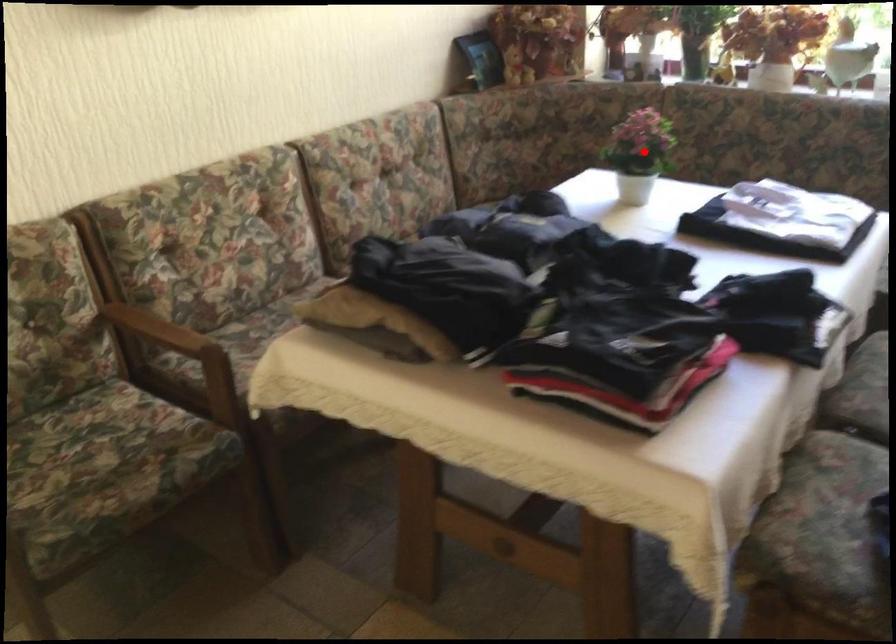
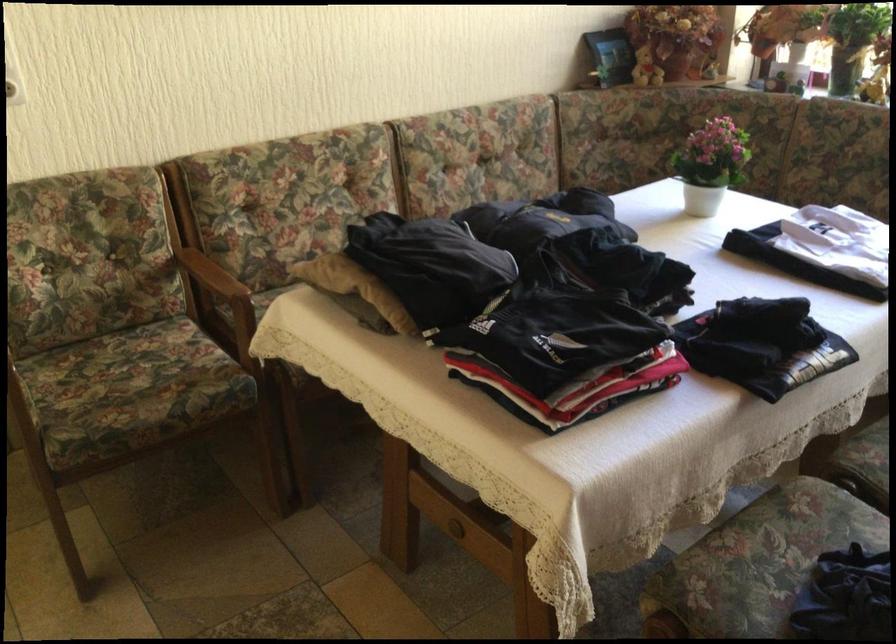
Where in the second image is the point corresponding to the highlighted location from the first image?

(711, 164)